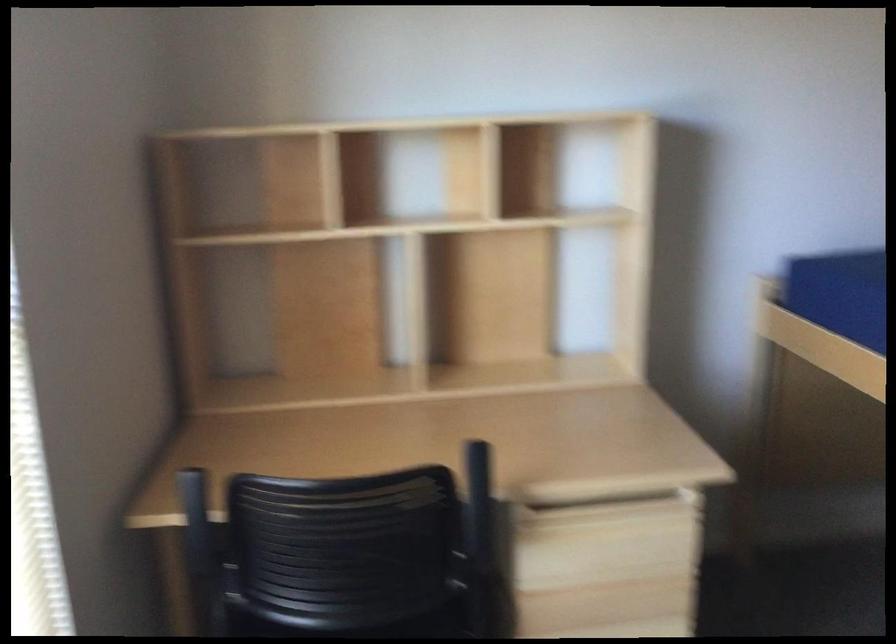
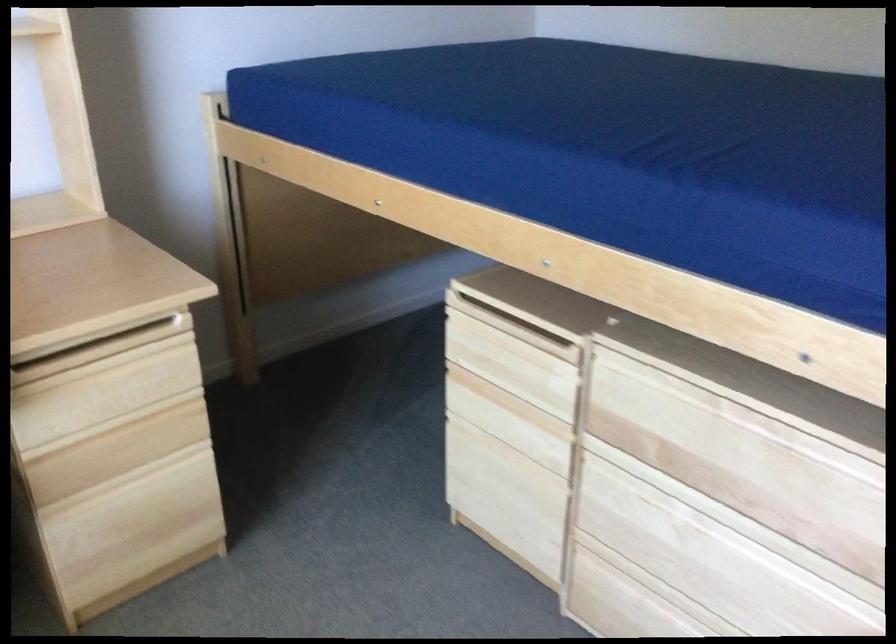
Question: How did the camera likely rotate?

Choices:
 (A) Left
 (B) Right
 (C) Up
 (D) Down

Answer: (B)